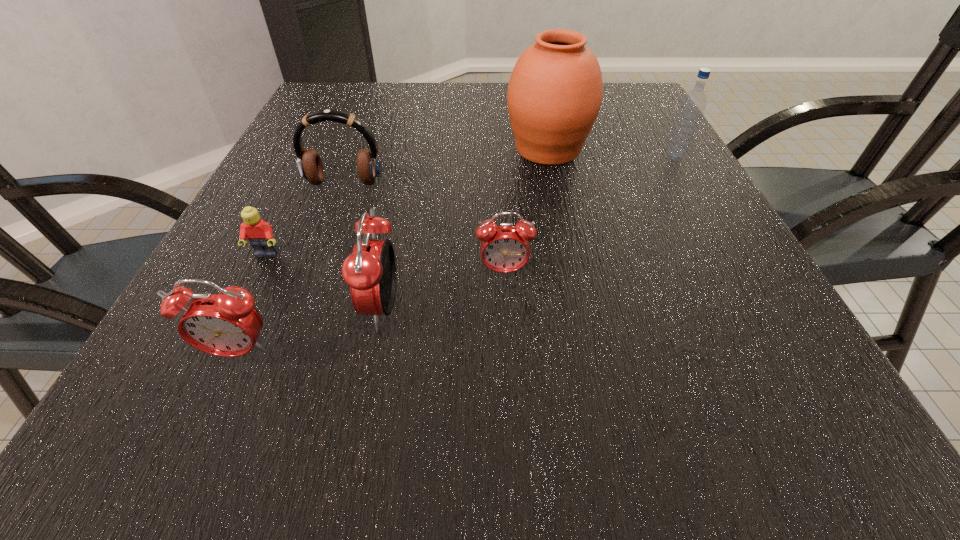
The width and height of the screenshot is (960, 540). I want to click on vacant position located on the face of the second alarm clock from right to left, so click(199, 309).

Find the location of `vacant space located 0.150m on the face of the second alarm clock from right to left`. vacant space located 0.150m on the face of the second alarm clock from right to left is located at coordinates (270, 309).

I want to click on vacant space located 0.110m on the face of the shortest alarm clock, so click(507, 333).

Locate an element on the screen. blank space located 0.330m on the ear cup of the headset is located at coordinates (295, 318).

Identify the location of free space located 0.320m on the left of the urn. This screenshot has width=960, height=540. point(366,150).

The image size is (960, 540). I want to click on blank space located on the front of the rightmost object, so click(x=709, y=217).

The height and width of the screenshot is (540, 960). Identify the location of vacant space located 0.100m on the face of the fourth nearest object. (242, 306).

You are a GUI agent. You are given a task and a screenshot of the screen. Output one action in this format:
    pyautogui.click(x=<x>, y=<y>)
    Task: Click on the alarm clock located in the left edge section of the desktop
    The image size is (960, 540).
    Given the screenshot: What is the action you would take?
    pyautogui.click(x=226, y=324)

I want to click on headset at the left edge, so click(x=309, y=164).

The width and height of the screenshot is (960, 540). I want to click on Lego present at the left edge, so click(x=259, y=233).